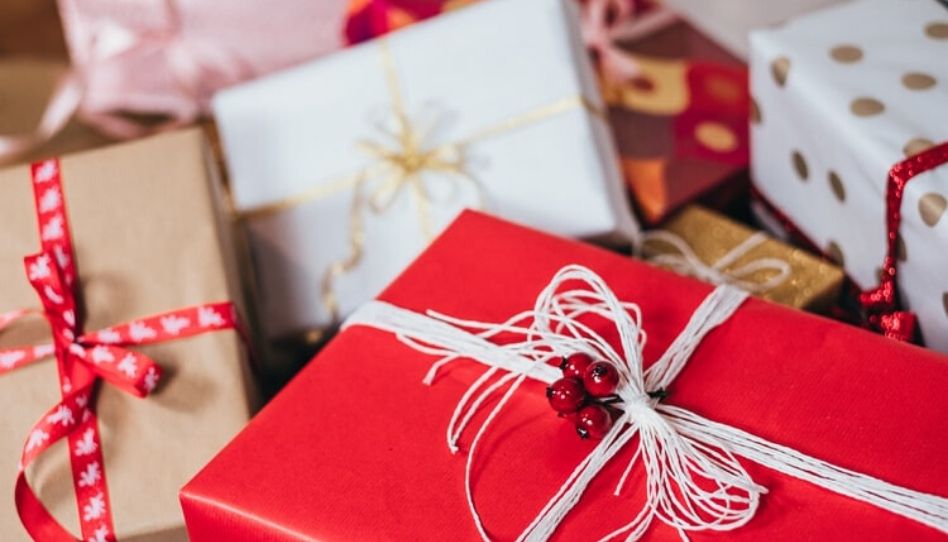
You are a GUI agent. You are given a task and a screenshot of the screen. Output one action in this format:
    pyautogui.click(x=<x>, y=<y>)
    Task: Click on the gift wrapped packages
    
    Given the screenshot: What is the action you would take?
    pyautogui.click(x=153, y=202), pyautogui.click(x=235, y=34), pyautogui.click(x=644, y=100), pyautogui.click(x=516, y=73), pyautogui.click(x=520, y=282), pyautogui.click(x=812, y=164), pyautogui.click(x=781, y=269), pyautogui.click(x=717, y=16)